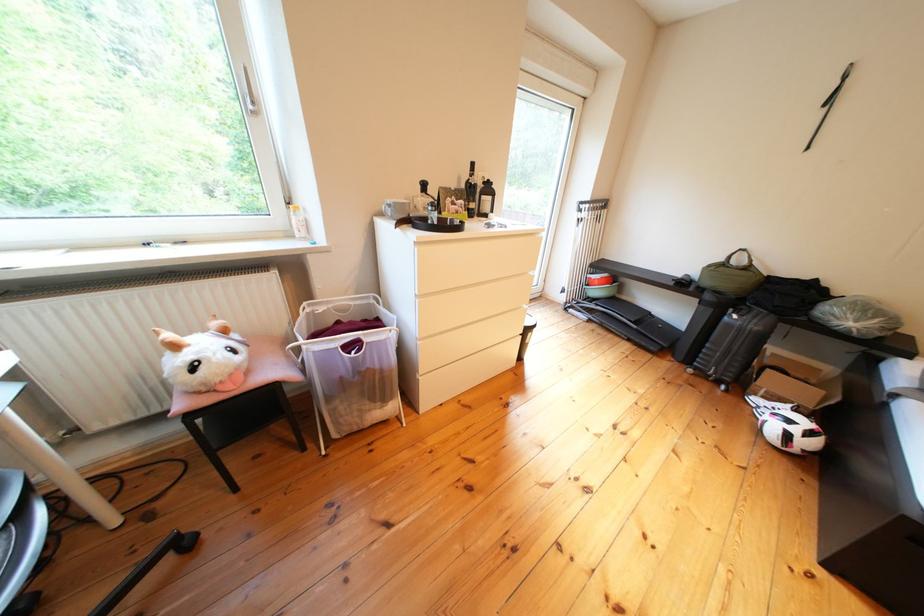
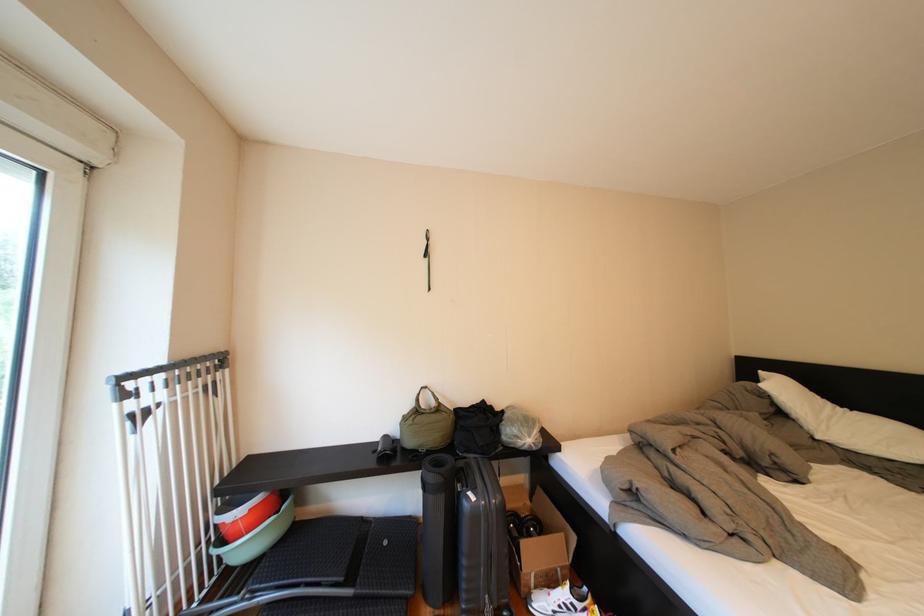
In the second image, find the point that corresponds to the point at 784,376 in the first image.

(538, 548)